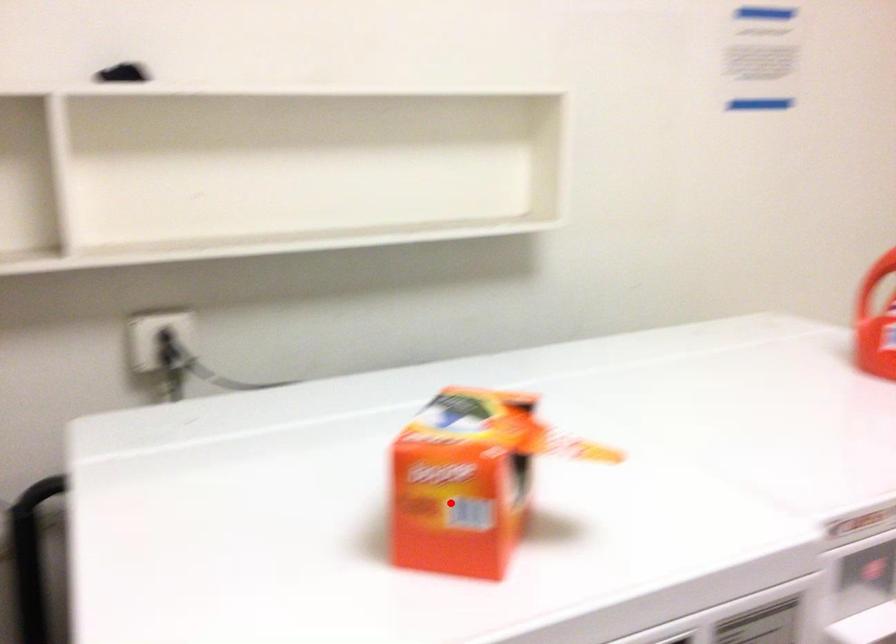
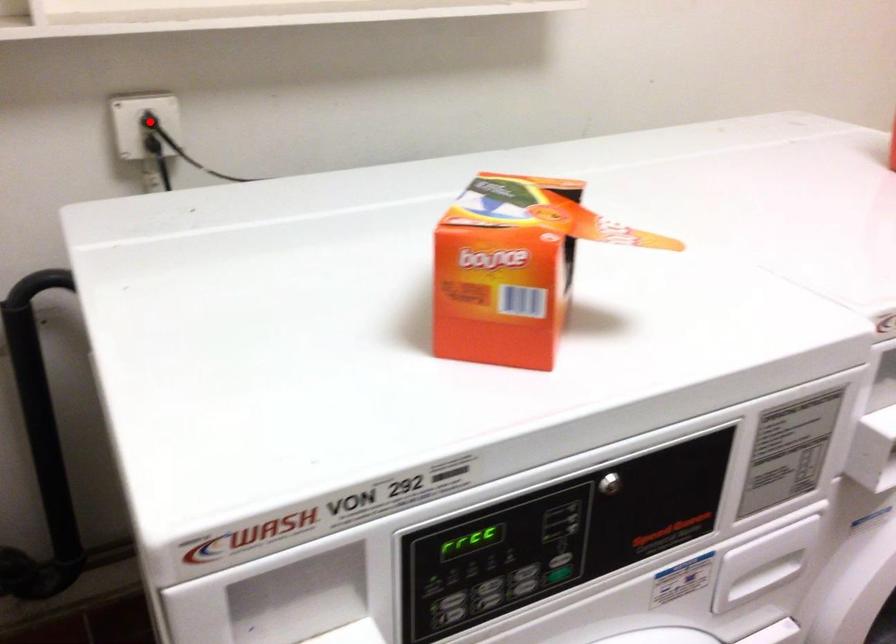
I am providing you with two images of the same scene from different viewpoints. A red point is marked on the first image and another point is marked on the second image. Does the point marked in image1 correspond to the same location as the one in image2?

No